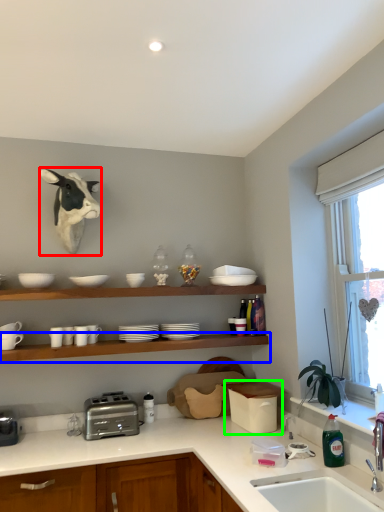
Question: Which is farther away from cattle (highlighted by a red box)? shelve (highlighted by a blue box) or appliance (highlighted by a green box)?

Choices:
 (A) shelve
 (B) appliance

Answer: (B)